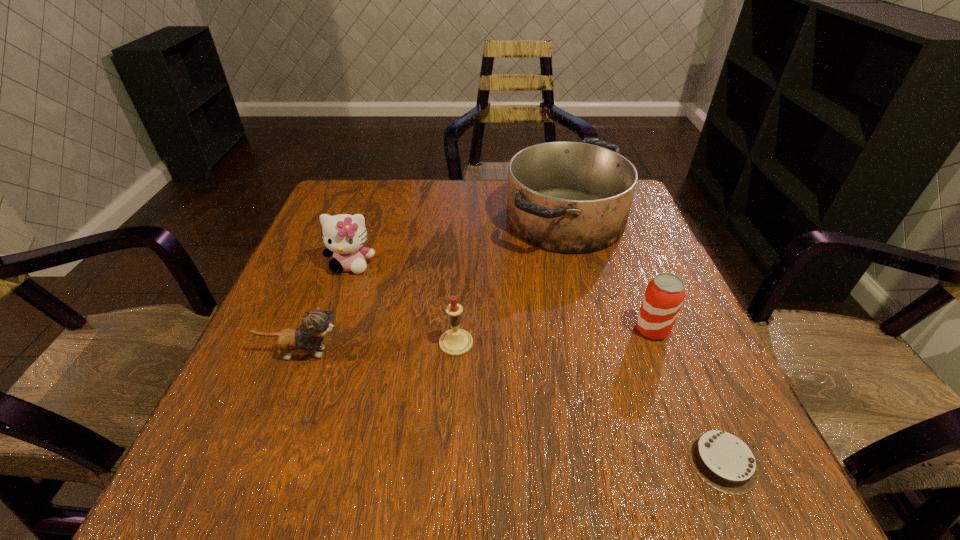
Where is `empty location between the beer can and the shortest object`? Image resolution: width=960 pixels, height=540 pixels. empty location between the beer can and the shortest object is located at coordinates (687, 396).

Identify the location of unoccupied area between the shorter kitten and the beer can. (477, 341).

You are a GUI agent. You are given a task and a screenshot of the screen. Output one action in this format:
    pyautogui.click(x=<x>, y=<y>)
    Task: Click on the blank region between the fourth object from right to left and the beer can
    
    Given the screenshot: What is the action you would take?
    pyautogui.click(x=554, y=336)

This screenshot has height=540, width=960. Find the location of `free space between the farther kitten and the candle`. free space between the farther kitten and the candle is located at coordinates (403, 304).

Find the location of a particular element. free spot between the saucepan and the beer can is located at coordinates (609, 274).

The width and height of the screenshot is (960, 540). Identify the location of object that ranks as the second closest to the beer can. (724, 461).

Find the location of a particular element. Image resolution: width=960 pixels, height=540 pixels. object that is the third closest to the farther kitten is located at coordinates (568, 197).

Where is `blank space that satisfies the following two spatial constraints: 1. on the front-facing side of the beer can; 2. on the right side of the taller kitten`? This screenshot has height=540, width=960. blank space that satisfies the following two spatial constraints: 1. on the front-facing side of the beer can; 2. on the right side of the taller kitten is located at coordinates (329, 329).

Find the location of `free space that satisfies the following two spatial constraints: 1. on the front side of the saucepan; 2. on the front-facing side of the shorter kitten`. free space that satisfies the following two spatial constraints: 1. on the front side of the saucepan; 2. on the front-facing side of the shorter kitten is located at coordinates (599, 353).

You are a GUI agent. You are given a task and a screenshot of the screen. Output one action in this format:
    pyautogui.click(x=<x>, y=<y>)
    Task: Click on the free space that satisfies the following two spatial constraints: 1. on the front-facing side of the taller kitten; 2. on the right side of the shortest object
    The height and width of the screenshot is (540, 960).
    Given the screenshot: What is the action you would take?
    pos(283,462)